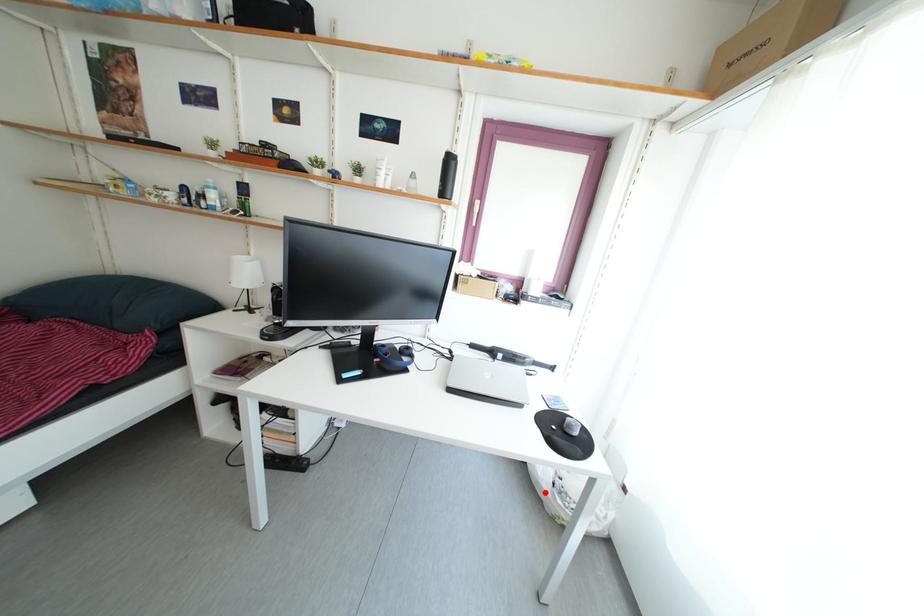
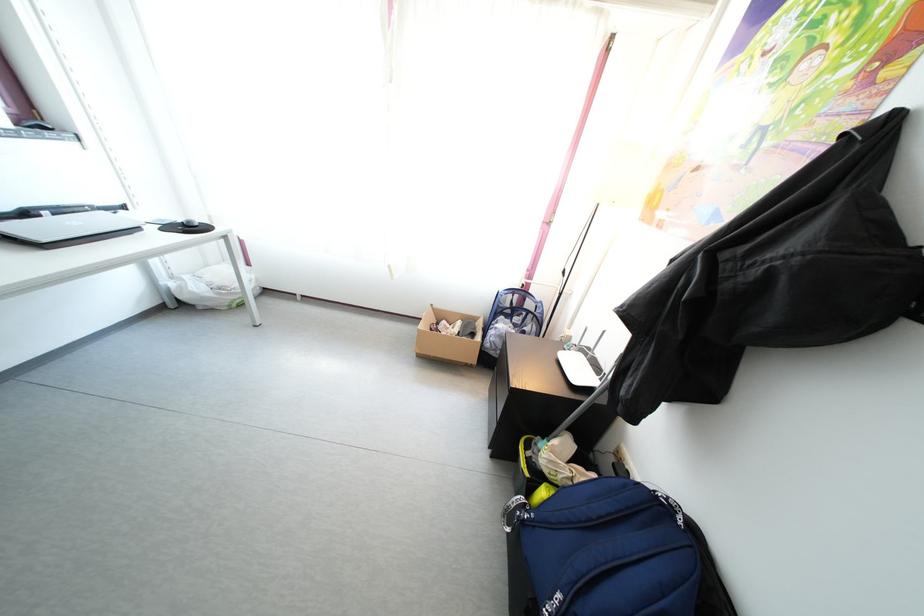
Question: I am providing you with two images of the same scene from different viewpoints. Image1 has a red point marked. In image2, the corresponding 3D location appears at what relative position? Reply with the corresponding letter.

Choices:
 (A) Closer
 (B) Farther

Answer: (A)